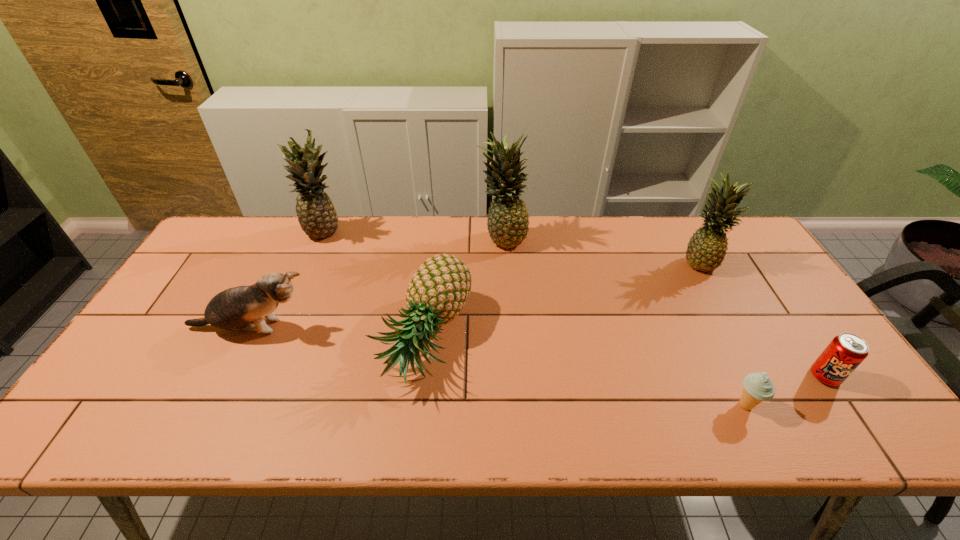
Locate an element on the screen. This screenshot has width=960, height=540. free space in the image that satisfies the following two spatial constraints: 1. on the back side of the icecream; 2. at the face of the cat is located at coordinates (708, 328).